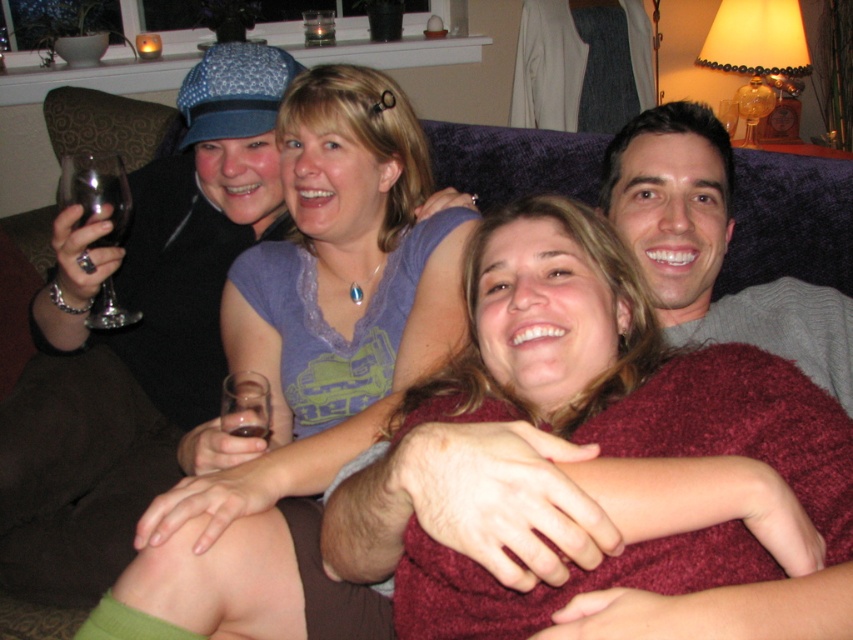
You are a photographer standing in front of the scene. You want to take a photo of the matte purple shirt at center and the transparent plastic wine glass at upper center. Which object will appear larger in the photo?

The matte purple shirt at center will appear larger in the photo because it is closer to the viewer than the transparent plastic wine glass at upper center.

You are a photographer standing 3 meters away from the scene. You want to take a photo of the matte purple shirt at center and the transparent plastic wine glass at upper center. Can you ensure both objects are in focus without adjusting your camera settings?

The matte purple shirt at center and transparent plastic wine glass at upper center are 2.16 meters apart from each other. Since the photographer is 3 meters away, the distance between the objects is within the depth of field at that distance, so both objects can be in focus without adjusting the camera settings.

You are standing at the origin point in the image. Which of the two points, point (370, 97) or point (726, 131), is closer to you?

Point (370, 97) is closer to you because it is in front of point (726, 131).